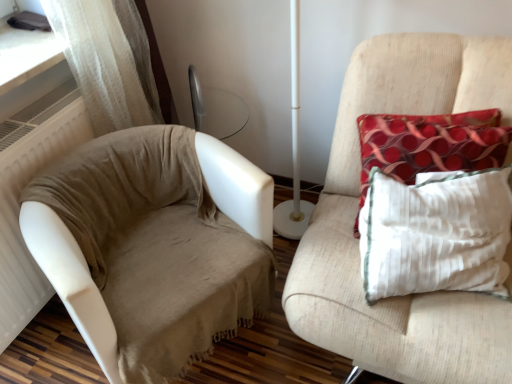
Question: From their relative heights in the image, would you say beige fabric couch at left is taller or shorter than red dotted fabric pillow at right?

Choices:
 (A) tall
 (B) short

Answer: (A)

Question: Is beige fabric couch at left wider or thinner than red dotted fabric pillow at right?

Choices:
 (A) wide
 (B) thin

Answer: (A)

Question: Which of these objects is positioned closest to the beige fabric couch at left?

Choices:
 (A) red dotted fabric pillow at right
 (B) textured beige armchair at right

Answer: (B)

Question: Which is nearer to the beige fabric couch at left?

Choices:
 (A) red dotted fabric pillow at right
 (B) textured beige armchair at right

Answer: (B)